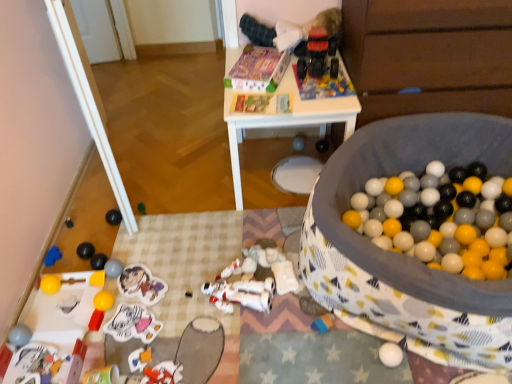
Find the location of a particular element. The width and height of the screenshot is (512, 384). free space that is in between matte white sticker at center, the eighth toy in the right-to-left sequence, and white matte robot at center, marked as the fifteenth toy in a left-to-right arrangement is located at coordinates (186, 314).